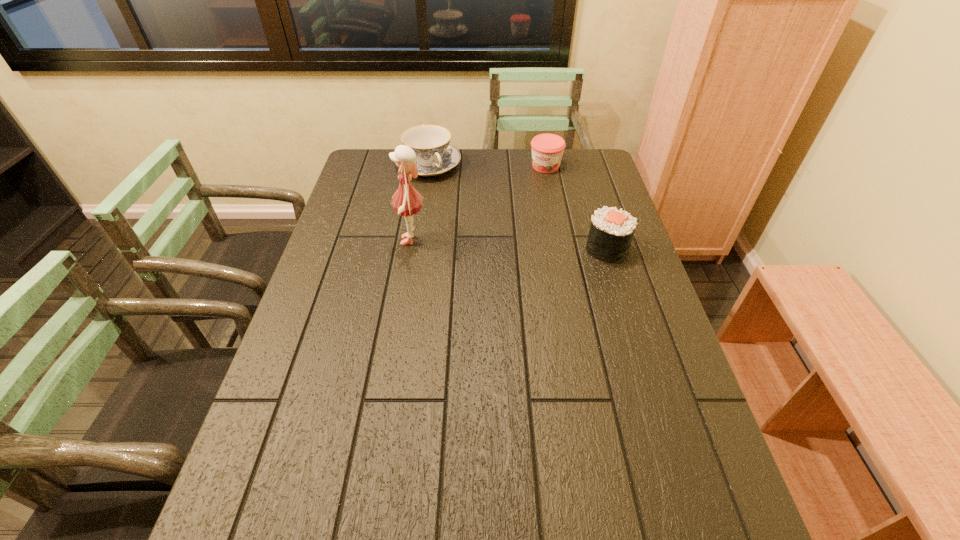
The height and width of the screenshot is (540, 960). I want to click on vacant space that satisfies the following two spatial constraints: 1. on the front side of the rightmost object; 2. on the left side of the chinaware, so click(416, 249).